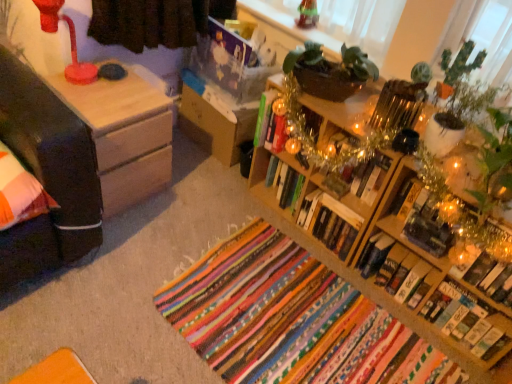
Question: Based on their sizes in the image, would you say matte plastic lamp at upper left is bigger or smaller than hardcover book at center, the seventh book positioned from the right?

Choices:
 (A) small
 (B) big

Answer: (B)

Question: Is matte plastic lamp at upper left in front of or behind hardcover book at center, the seventh book positioned from the right, in the image?

Choices:
 (A) front
 (B) behind

Answer: (A)

Question: Estimate the real-world distances between objects in this image. Which object is farther from the hardcover book at center, marked as the first book in a left-to-right arrangement?

Choices:
 (A) wooden nightstand at center
 (B) hardcover book at center, which is the seventh book in left-to-right order
 (C) wooden bookshelf at right
 (D) green matte cactus at upper right
 (E) wooden nightstand at left

Answer: (B)

Question: Estimate the real-world distances between objects in this image. Which object is farther from the hardcover book at center-right, marked as the 3th book in a left-to-right arrangement?

Choices:
 (A) wooden nightstand at center
 (B) multicolored woven rug at center
 (C) hardcover book at center-right, the 2th book viewed from the left
 (D) metallic gold book at center-right, the 4th book in the left-to-right sequence
 (E) matte plastic lamp at upper left

Answer: (E)